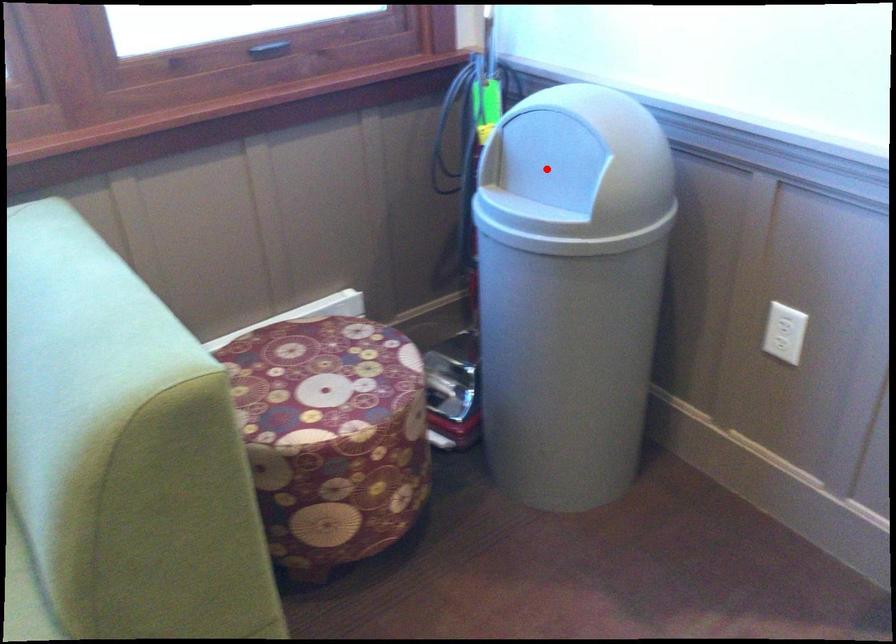
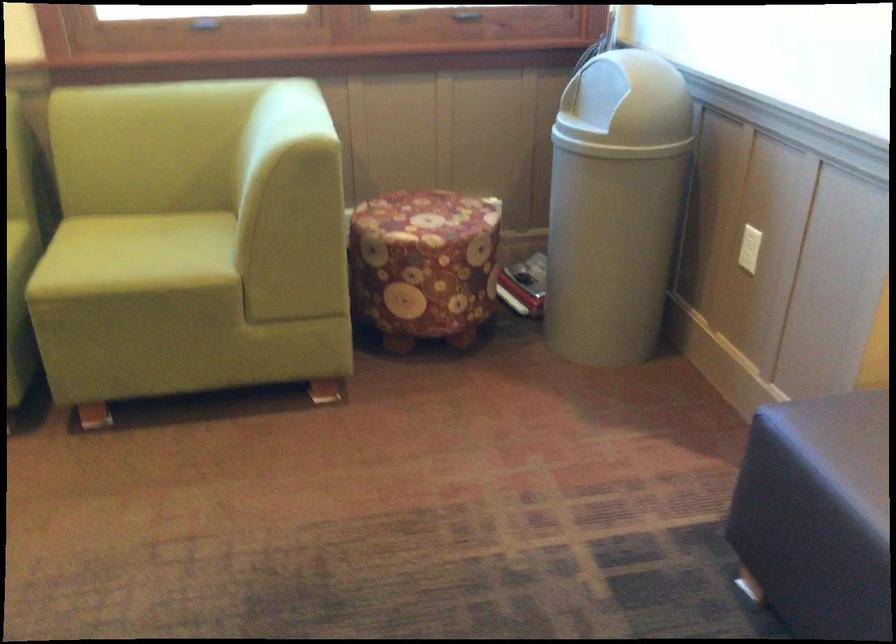
The point at the highlighted location is marked in the first image. Where is the corresponding point in the second image?

(598, 99)